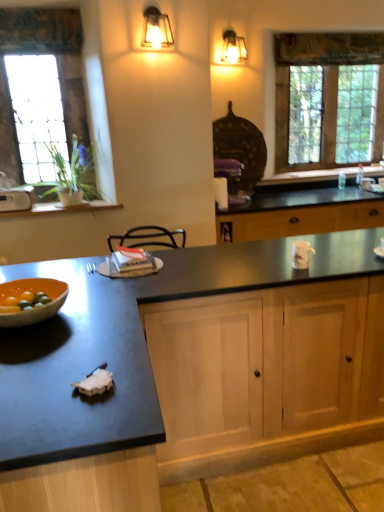
In order to face light wood cabinet at center, should I rotate leftwards or rightwards?

Rotate right and turn 13.662 degrees.

Locate an element on the screen. The width and height of the screenshot is (384, 512). wooden window sill at lower left is located at coordinates (61, 208).

Describe the element at coordinates (156, 29) in the screenshot. I see `metallic lantern at upper center, acting as the 1th light fixture starting from the front` at that location.

Locate an element on the screen. orange matte bowl at left is located at coordinates (32, 291).

Does point (102, 377) lie in front of point (72, 24)?

Yes.

Which is more to the right, white crumbly food at center or clear glass window at left, the second window from the right?

From the viewer's perspective, white crumbly food at center appears more on the right side.

Is white crumbly food at center next to clear glass window at left, the second window from the right, and touching it?

No, white crumbly food at center is not next to clear glass window at left, the second window from the right.

Is clear glass window at left, marked as the 2th window in a back-to-front arrangement, located within white crumbly food at center?

No, clear glass window at left, marked as the 2th window in a back-to-front arrangement, is located outside of white crumbly food at center.

Between white crumbly food at center and metallic wall sconce at upper center, which appears as the 1th light fixture when viewed from the right, which one has smaller width?

white crumbly food at center.

Between point (78, 390) and point (230, 56), which one is positioned behind?

Positioned behind is point (230, 56).

Does white crumbly food at center touch metallic wall sconce at upper center, marked as the second light fixture in a bottom-to-top arrangement?

No, white crumbly food at center is not touching metallic wall sconce at upper center, marked as the second light fixture in a bottom-to-top arrangement.

From the image's perspective, relative to metallic wall sconce at upper center, marked as the second light fixture in a bottom-to-top arrangement, is white crumbly food at center above or below?

From the image's perspective, white crumbly food at center appears below metallic wall sconce at upper center, marked as the second light fixture in a bottom-to-top arrangement.

From a real-world perspective, who is located lower, metallic lantern at upper center, arranged as the 1th light fixture when ordered from the bottom, or orange matte bowl at left?

From a 3D spatial view, orange matte bowl at left is below.

The width and height of the screenshot is (384, 512). In the image, there is a metallic lantern at upper center, the 1th light fixture positioned from the left. Identify the location of bowl below it (from a real-world perspective). (32, 291).

From the image's perspective, is metallic lantern at upper center, the 1th light fixture positioned from the left, positioned above or below orange matte bowl at left?

Based on their image positions, metallic lantern at upper center, the 1th light fixture positioned from the left, is located above orange matte bowl at left.

Considering the relative positions of metallic lantern at upper center, the second light fixture when ordered from back to front, and orange matte bowl at left in the image provided, is metallic lantern at upper center, the second light fixture when ordered from back to front, to the left of orange matte bowl at left from the viewer's perspective?

In fact, metallic lantern at upper center, the second light fixture when ordered from back to front, is to the right of orange matte bowl at left.

From the picture: Is clear glass window at upper right, which is counted as the second window, starting from the front, positioned in front of orange matte bowl at left?

No, the depth of clear glass window at upper right, which is counted as the second window, starting from the front, is greater than that of orange matte bowl at left.

From their relative heights in the image, would you say clear glass window at upper right, which is counted as the second window, starting from the front, is taller or shorter than orange matte bowl at left?

clear glass window at upper right, which is counted as the second window, starting from the front, is taller than orange matte bowl at left.

From the image's perspective, is clear glass window at upper right, positioned as the second window in left-to-right order, above or below orange matte bowl at left?

Clearly, from the image's perspective, clear glass window at upper right, positioned as the second window in left-to-right order, is above orange matte bowl at left.

Is orange matte bowl at left surrounded by clear glass window at upper right, which is counted as the second window, starting from the front?

Actually, orange matte bowl at left is outside clear glass window at upper right, which is counted as the second window, starting from the front.

From the image's perspective, who appears lower, metallic lantern at upper center, the second light fixture when ordered from back to front, or black granite countertop at center?

From the image's view, black granite countertop at center is below.

Relative to black granite countertop at center, is metallic lantern at upper center, the second light fixture when ordered from back to front, in front or behind?

metallic lantern at upper center, the second light fixture when ordered from back to front, is positioned farther from the viewer than black granite countertop at center.

How much distance is there between metallic lantern at upper center, acting as the 1th light fixture starting from the front, and black granite countertop at center?

metallic lantern at upper center, acting as the 1th light fixture starting from the front, is 6.41 feet away from black granite countertop at center.

Is metallic lantern at upper center, acting as the 1th light fixture starting from the front, inside the boundaries of black granite countertop at center, or outside?

The correct answer is: outside.

Could you tell me if metallic wall sconce at upper center, the first light fixture viewed from the back, is facing clear glass window at left, the second window from the right?

No.

Do you think metallic wall sconce at upper center, which is the 2th light fixture from front to back, is within clear glass window at left, marked as the 2th window in a back-to-front arrangement, or outside of it?

metallic wall sconce at upper center, which is the 2th light fixture from front to back, is not enclosed by clear glass window at left, marked as the 2th window in a back-to-front arrangement.

Between metallic wall sconce at upper center, the 2th light fixture when ordered from left to right, and clear glass window at left, the first window positioned from the front, which one has smaller size?

metallic wall sconce at upper center, the 2th light fixture when ordered from left to right.

Is metallic wall sconce at upper center, the first light fixture viewed from the back, wider or thinner than clear glass window at left, marked as the first window in a left-to-right arrangement?

Clearly, metallic wall sconce at upper center, the first light fixture viewed from the back, has more width compared to clear glass window at left, marked as the first window in a left-to-right arrangement.

From a real-world perspective, between metallic wall sconce at upper center, which appears as the 1th light fixture when viewed from the right, and clear glass window at upper right, which is counted as the second window, starting from the front, who is vertically higher?

metallic wall sconce at upper center, which appears as the 1th light fixture when viewed from the right, is physically above.

From the image's perspective, does metallic wall sconce at upper center, the first light fixture viewed from the back, appear lower than clear glass window at upper right, placed as the 1th window when sorted from right to left?

No, from the image's perspective, metallic wall sconce at upper center, the first light fixture viewed from the back, is not below clear glass window at upper right, placed as the 1th window when sorted from right to left.

Considering the points (227, 53) and (282, 40), which point is in front, point (227, 53) or point (282, 40)?

The point (227, 53) is closer.

In the image, there is a clear glass window at left, marked as the 2th window in a back-to-front arrangement. Identify the location of food below it (from the image's perspective). (95, 382).

You are a GUI agent. You are given a task and a screenshot of the screen. Output one action in this format:
    pyautogui.click(x=<x>, y=<y>)
    Task: Click on the 2nd light fixture to the right of the white crumbly food at center, starting your count from the anchor
    The height and width of the screenshot is (512, 384).
    Given the screenshot: What is the action you would take?
    pyautogui.click(x=233, y=48)

When comparing their distances from metallic lantern at upper center, arranged as the 1th light fixture when ordered from the bottom, does wooden window sill at lower left or clear glass window at left, marked as the 2th window in a back-to-front arrangement, seem further?

The object further to metallic lantern at upper center, arranged as the 1th light fixture when ordered from the bottom, is wooden window sill at lower left.

Looking at the image, which one is located further to orange matte bowl at left, wooden window sill at lower left or metallic lantern at upper center, the second light fixture when ordered from right to left?

Based on the image, metallic lantern at upper center, the second light fixture when ordered from right to left, appears to be further to orange matte bowl at left.

From the image, which object appears to be farther from black granite countertop at center, orange matte bowl at left or clear glass window at left, the first window positioned from the front?

The object further to black granite countertop at center is clear glass window at left, the first window positioned from the front.

Considering their positions, is light wood cabinet at center positioned closer to metallic lantern at upper center, acting as the 1th light fixture starting from the front, than clear glass window at upper right, arranged as the first window when viewed from the back?

The object closer to metallic lantern at upper center, acting as the 1th light fixture starting from the front, is clear glass window at upper right, arranged as the first window when viewed from the back.

Based on their spatial positions, is orange matte bowl at left or light wood cabinet at center further from clear glass window at left, marked as the first window in a left-to-right arrangement?

The object further to clear glass window at left, marked as the first window in a left-to-right arrangement, is light wood cabinet at center.

Which object lies nearer to the anchor point clear glass window at upper right, placed as the 1th window when sorted from right to left, metallic wall sconce at upper center, marked as the second light fixture in a bottom-to-top arrangement, or orange matte bowl at left?

metallic wall sconce at upper center, marked as the second light fixture in a bottom-to-top arrangement, is positioned closer to the anchor clear glass window at upper right, placed as the 1th window when sorted from right to left.

Looking at the image, which one is located closer to metallic wall sconce at upper center, the 2th light fixture when ordered from left to right, black granite countertop at center or orange matte bowl at left?

orange matte bowl at left lies closer to metallic wall sconce at upper center, the 2th light fixture when ordered from left to right, than the other object.

Based on their spatial positions, is wooden window sill at lower left or white crumbly food at center closer to metallic wall sconce at upper center, the 2th light fixture when ordered from left to right?

wooden window sill at lower left.

Locate an element on the screen. Image resolution: width=384 pixels, height=512 pixels. window between metallic lantern at upper center, which is counted as the second light fixture, starting from the top, and white crumbly food at center, in the vertical direction is located at coordinates (58, 71).

Locate an element on the screen. This screenshot has height=512, width=384. food positioned between black granite countertop at center and clear glass window at left, the second window from the right, from near to far is located at coordinates (95, 382).

Identify the location of light fixture between metallic wall sconce at upper center, which appears as the 1th light fixture when viewed from the right, and orange matte bowl at left vertically. pyautogui.click(x=156, y=29).

Where is `window sill positioned between white crumbly food at center and metallic wall sconce at upper center, the 1th light fixture from the top, from near to far`? This screenshot has height=512, width=384. window sill positioned between white crumbly food at center and metallic wall sconce at upper center, the 1th light fixture from the top, from near to far is located at coordinates (61, 208).